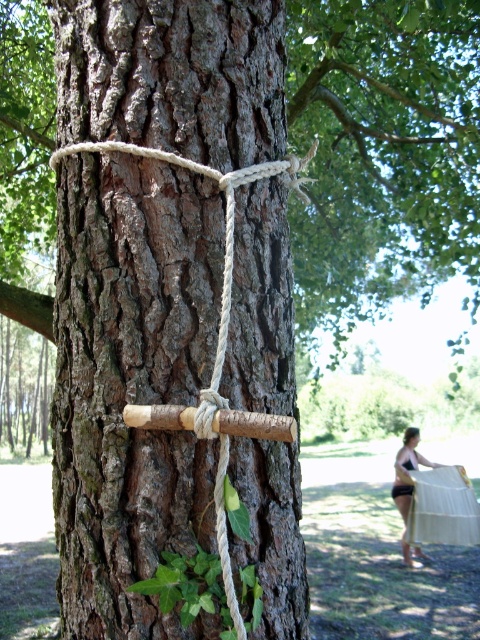
Question: Which object is closer to the camera taking this photo?

Choices:
 (A) rough bark tree trunk at center
 (B) brown rough wood at center

Answer: (A)

Question: Does rough bark tree trunk at center appear on the left side of brown rough wood at center?

Choices:
 (A) no
 (B) yes

Answer: (B)

Question: Is the position of rough bark tree trunk at center less distant than that of brown rough wood at center?

Choices:
 (A) no
 (B) yes

Answer: (B)

Question: Which object appears farthest from the camera in this image?

Choices:
 (A) brown rough wood at center
 (B) rough bark tree trunk at center

Answer: (A)

Question: Can you confirm if rough bark tree trunk at center is positioned above brown rough wood at center?

Choices:
 (A) no
 (B) yes

Answer: (A)

Question: Which point is farther to the camera?

Choices:
 (A) brown rough wood at center
 (B) rough bark tree trunk at center

Answer: (A)